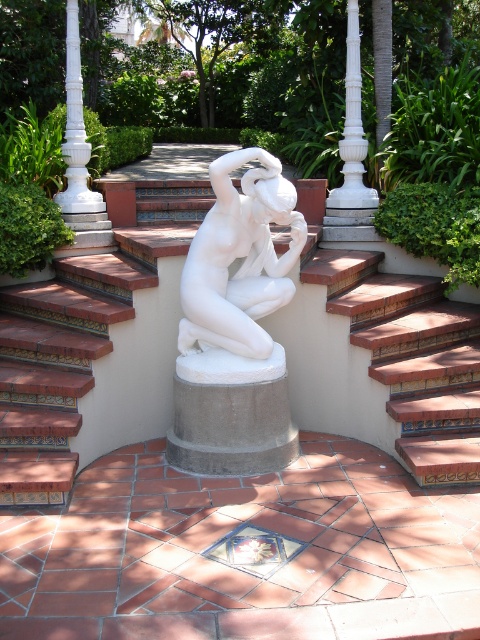
From the picture: You are standing at the edge of the tiled patio and want to reach the sculpture at the center. There is a point marked at coordinates point (411,356). Is this point located on the terracotta tile stairs that lead towards the sculpture?

Yes, the point (411,356) is on the terracotta tile stairs at center, which are part of the path leading towards the sculpture.

You are standing at the base of the terracotta tile stairs at center and want to reach the white marble pillar at center. Which direction should you move to get there?

You should move to the left because the terracotta tile stairs at center are to the right of the white marble pillar at center, so moving left will take you towards the pillar.

You are a delivery person carrying a large package that requires a stable surface to place. Based on the scene, which object between the terracotta tile stairs at center and the white marble statue at center would be more suitable for placing the package?

The terracotta tile stairs at center has a larger size compared to the white marble statue at center, making it a more stable surface for placing the large package.